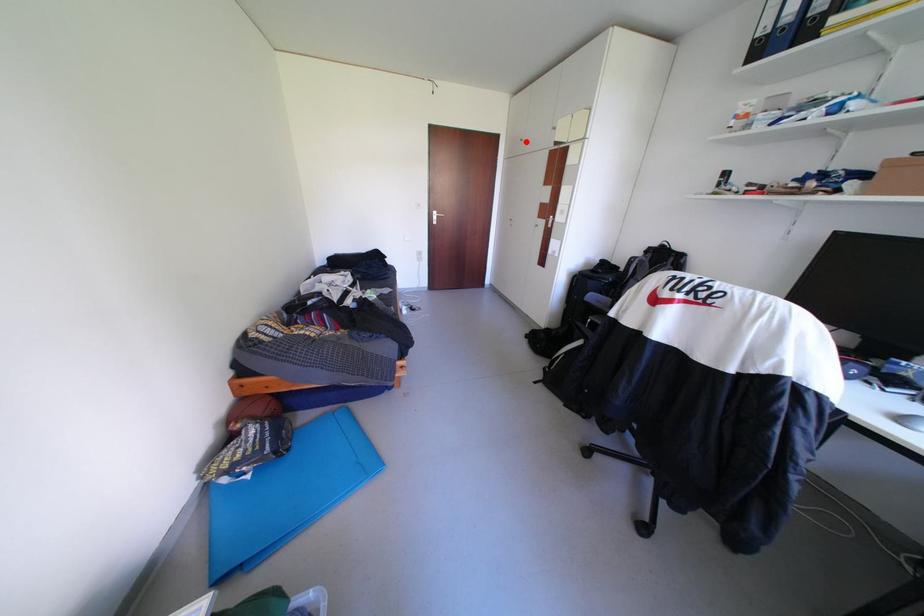
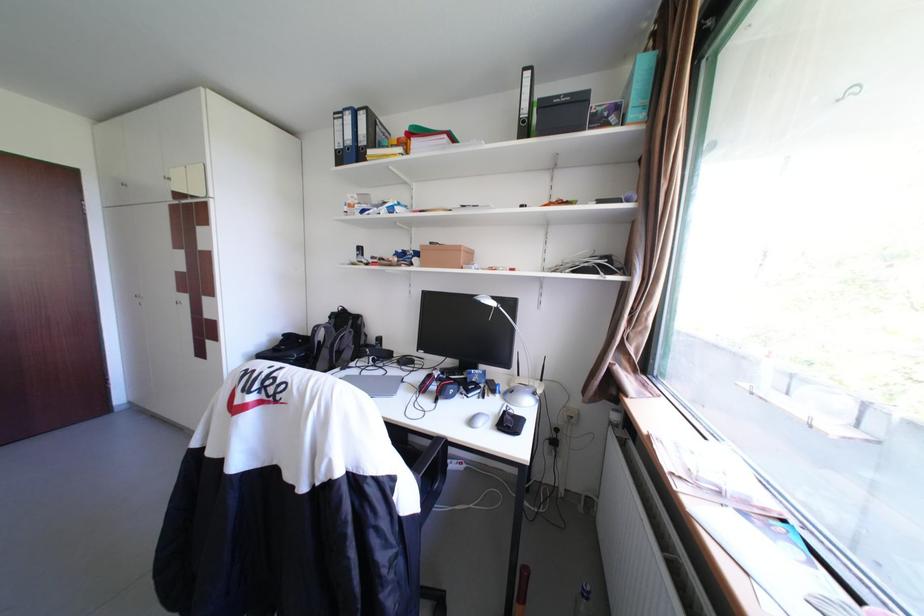
Question: I am providing you with two images of the same scene from different viewpoints. In image1, a red point is highlighted. Considering the same 3D point in image2, which of the following is correct?

Choices:
 (A) It is closer
 (B) It is farther

Answer: (B)